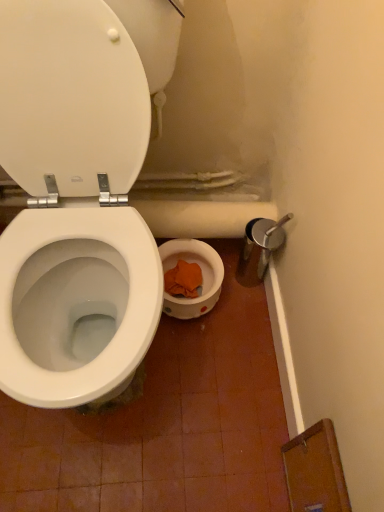
Question: Considering the relative sizes of white glossy toilet at center and white glossy toilet lid at upper left in the image provided, is white glossy toilet at center smaller than white glossy toilet lid at upper left?

Choices:
 (A) yes
 (B) no

Answer: (B)

Question: Would you say white glossy toilet lid at upper left is part of white glossy toilet at center's contents?

Choices:
 (A) yes
 (B) no

Answer: (A)

Question: Is white glossy toilet at center to the left of white glossy toilet lid at upper left from the viewer's perspective?

Choices:
 (A) yes
 (B) no

Answer: (A)

Question: Are white glossy toilet at center and white glossy toilet lid at upper left far apart?

Choices:
 (A) no
 (B) yes

Answer: (A)

Question: Considering the relative sizes of white glossy toilet at center and white glossy toilet lid at upper left in the image provided, is white glossy toilet at center shorter than white glossy toilet lid at upper left?

Choices:
 (A) no
 (B) yes

Answer: (A)

Question: From a real-world perspective, is white glossy toilet at center located higher than white glossy toilet lid at upper left?

Choices:
 (A) no
 (B) yes

Answer: (B)

Question: Is white glossy toilet lid at upper left beside white glossy toilet at center?

Choices:
 (A) yes
 (B) no

Answer: (A)

Question: Is white glossy toilet at center inside white glossy toilet lid at upper left?

Choices:
 (A) yes
 (B) no

Answer: (B)

Question: From a real-world perspective, is white glossy toilet lid at upper left positioned over white glossy toilet at center based on gravity?

Choices:
 (A) no
 (B) yes

Answer: (A)

Question: Is white glossy toilet lid at upper left not within white glossy toilet at center?

Choices:
 (A) yes
 (B) no

Answer: (B)

Question: From the image's perspective, does white glossy toilet lid at upper left appear higher than white glossy toilet at center?

Choices:
 (A) no
 (B) yes

Answer: (B)

Question: From a real-world perspective, is white glossy toilet lid at upper left under white glossy toilet at center?

Choices:
 (A) yes
 (B) no

Answer: (A)

Question: From a real-world perspective, is white glossy toilet at center positioned above or below white glossy toilet lid at upper left?

Choices:
 (A) below
 (B) above

Answer: (B)